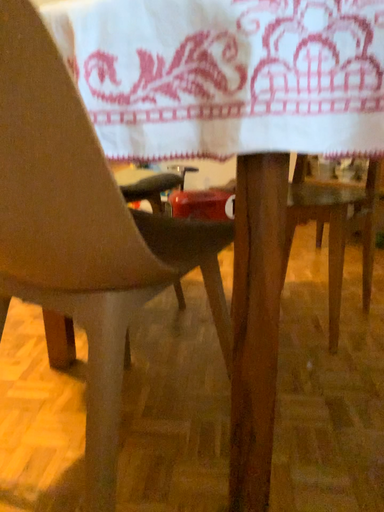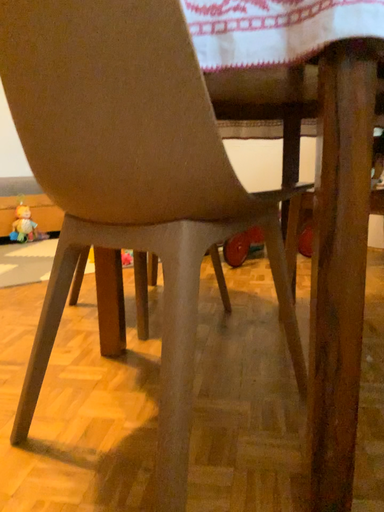
Question: Which way did the camera rotate in the video?

Choices:
 (A) rotated downward
 (B) rotated upward

Answer: (B)